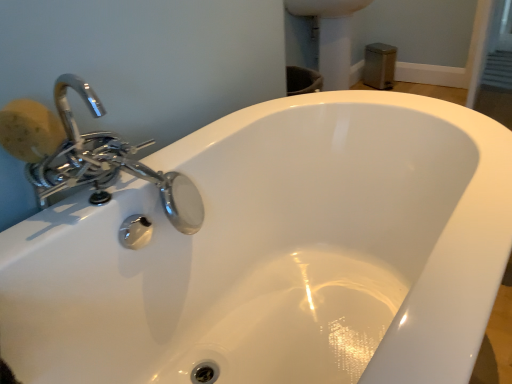
Question: Is satin nickel sink at upper right thinner than yellow sponge at left?

Choices:
 (A) no
 (B) yes

Answer: (A)

Question: Does satin nickel sink at upper right turn towards yellow sponge at left?

Choices:
 (A) yes
 (B) no

Answer: (B)

Question: Is satin nickel sink at upper right smaller than yellow sponge at left?

Choices:
 (A) yes
 (B) no

Answer: (B)

Question: Is satin nickel sink at upper right bigger than yellow sponge at left?

Choices:
 (A) yes
 (B) no

Answer: (A)

Question: Is satin nickel sink at upper right wider than yellow sponge at left?

Choices:
 (A) no
 (B) yes

Answer: (B)

Question: Does satin nickel sink at upper right have a lesser height compared to yellow sponge at left?

Choices:
 (A) no
 (B) yes

Answer: (A)

Question: From a real-world perspective, is yellow sponge at left positioned under satin nickel sink at upper right based on gravity?

Choices:
 (A) yes
 (B) no

Answer: (B)

Question: Considering the relative sizes of yellow sponge at left and satin nickel sink at upper right in the image provided, is yellow sponge at left shorter than satin nickel sink at upper right?

Choices:
 (A) no
 (B) yes

Answer: (B)

Question: Is yellow sponge at left positioned with its back to satin nickel sink at upper right?

Choices:
 (A) no
 (B) yes

Answer: (A)

Question: Is yellow sponge at left smaller than satin nickel sink at upper right?

Choices:
 (A) yes
 (B) no

Answer: (A)

Question: Is yellow sponge at left not within satin nickel sink at upper right?

Choices:
 (A) no
 (B) yes

Answer: (B)

Question: Is satin nickel sink at upper right inside yellow sponge at left?

Choices:
 (A) yes
 (B) no

Answer: (B)

Question: In terms of size, does yellow sponge at left appear bigger or smaller than satin nickel sink at upper right?

Choices:
 (A) small
 (B) big

Answer: (A)